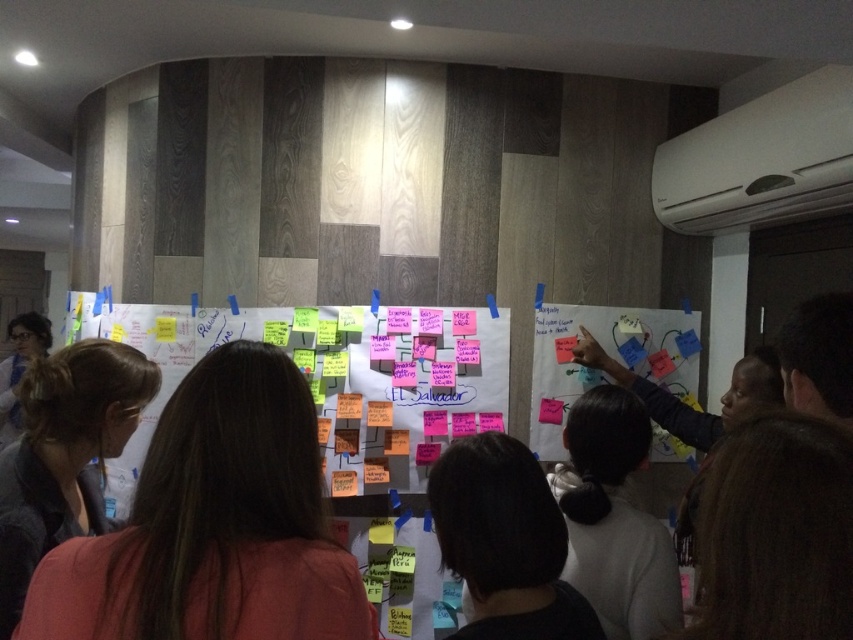
Based on the photo, you are a photographer trying to capture a clear shot of the dark brown hair at left and the pink sticky notes at center. Based on their sizes in the image, which object would require you to move closer to get a detailed photo?

The dark brown hair at left occupies less space than pink sticky notes at center, so you would need to move closer to the dark brown hair at left to capture its details clearly.

You are standing in front of the whiteboard and notice a person with brown hair at center. Can you tell me the exact coordinates where this person is located?

The brown hair at center is located at point (213, 524).

You are a photographer standing in front of the whiteboard. You want to take a photo of the brown hair at center and the multicolored sticky notes at center. Based on their positions, which object should you focus on first to ensure both are in the frame?

The brown hair at center is to the right of the multicolored sticky notes at center, so you should focus on the multicolored sticky notes at center first to ensure both are in the frame.